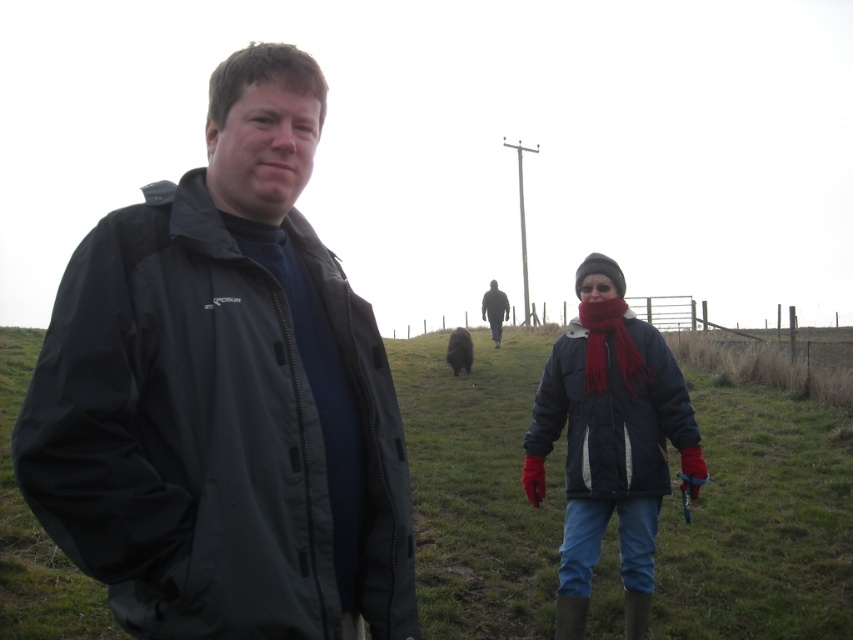
Based on the photo, can you confirm if matte black jacket at center is positioned to the left of dark blue quilted jacket at center?

Yes, matte black jacket at center is to the left of dark blue quilted jacket at center.

Does matte black jacket at center appear on the right side of dark blue quilted jacket at center?

Incorrect, matte black jacket at center is not on the right side of dark blue quilted jacket at center.

Measure the distance between point (180,452) and camera.

Point (180,452) and camera are 5.51 feet apart.

I want to click on matte black jacket at center, so click(x=224, y=396).

Is point (535, 477) less distant than point (601, 336)?

No, (535, 477) is further to viewer.

Does dark blue quilted jacket at center have a larger size compared to maroon knitted scarf at center?

Yes.

What are the coordinates of `dark blue quilted jacket at center` in the screenshot? It's located at (611, 419).

The height and width of the screenshot is (640, 853). What do you see at coordinates (759, 524) in the screenshot? I see `green grassy at center` at bounding box center [759, 524].

Which is in front, point (791, 484) or point (461, 356)?

Point (791, 484) is in front.

This screenshot has height=640, width=853. I want to click on green grassy at center, so click(759, 524).